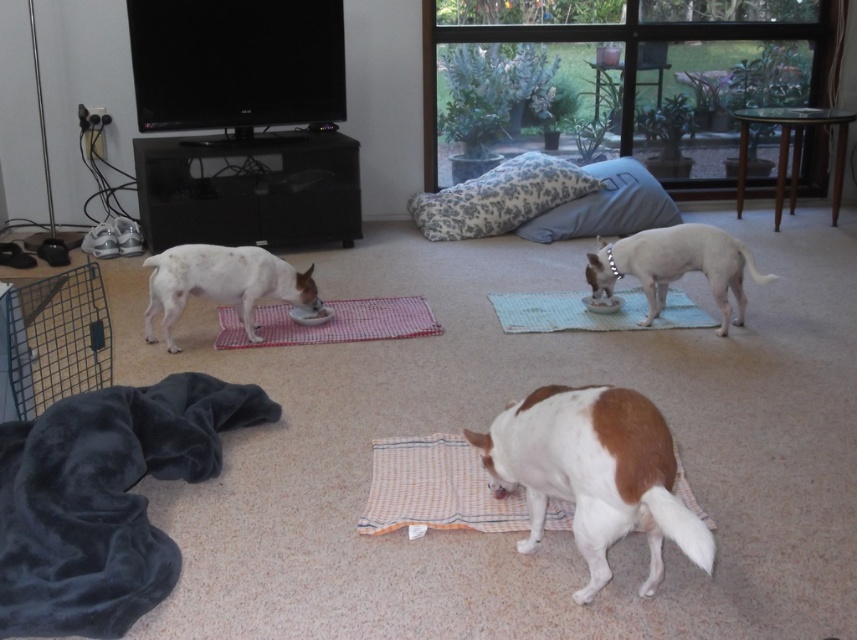
You are a small dog trying to reach your food bowl placed on the red checkered yoga mat at center. There is a fluffy white pillow at center in the way. Can you easily move around it to get to your bowl?

The fluffy white pillow at center is wider than the red checkered yoga mat at center, so it might block your path. You might need to go around it carefully since the pillow is wider.

You are a small dog wanting to reach the red checkered yoga mat at center from the fluffy white pillow at center. Which direction should you move to get closer to the mat?

The fluffy white pillow at center is further to the viewer than the red checkered yoga mat at center, so the dog should move backward to get closer to the mat.

You are a small dog wanting to reach the food bowl located at point (304, 330). There is an obstacle at point (655, 474). Can you navigate around it to reach your bowl?

Point (655, 474) is in front of point (304, 330), so the obstacle is blocking the path. The small dog cannot directly reach the bowl without moving around the obstacle.